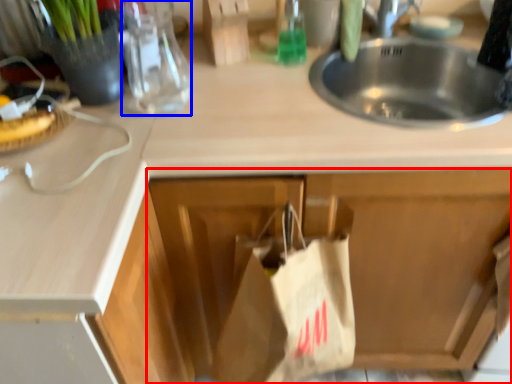
Question: Which point is further to the camera, cabinetry (highlighted by a red box) or bottle (highlighted by a blue box)?

Choices:
 (A) cabinetry
 (B) bottle

Answer: (B)